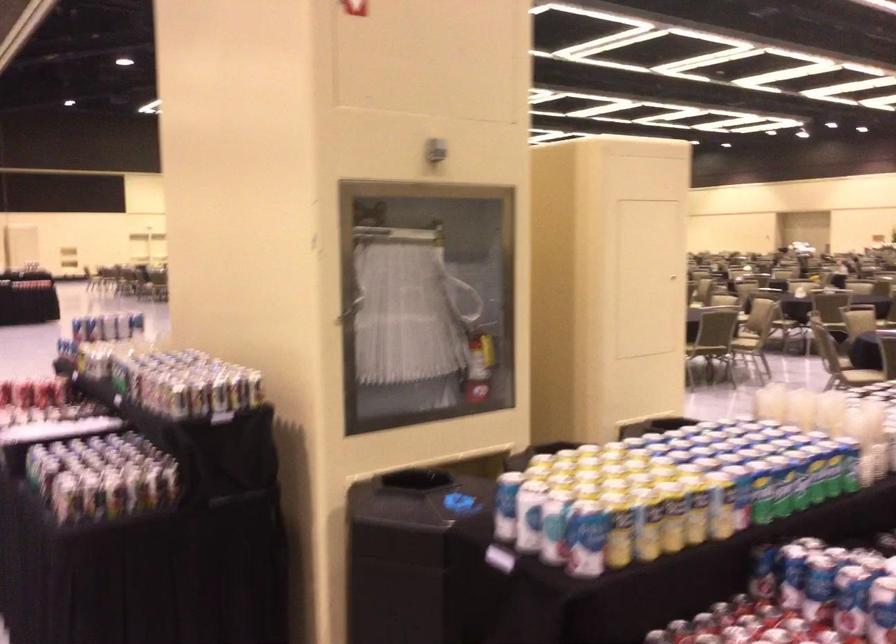
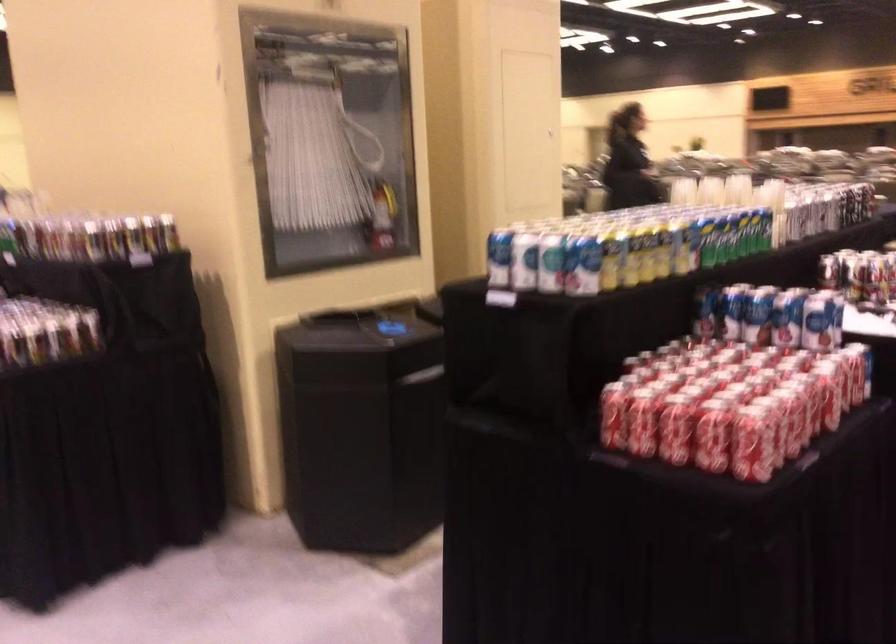
Where in the second image is the point corresponding to the point at 796,412 from the first image?

(711, 190)